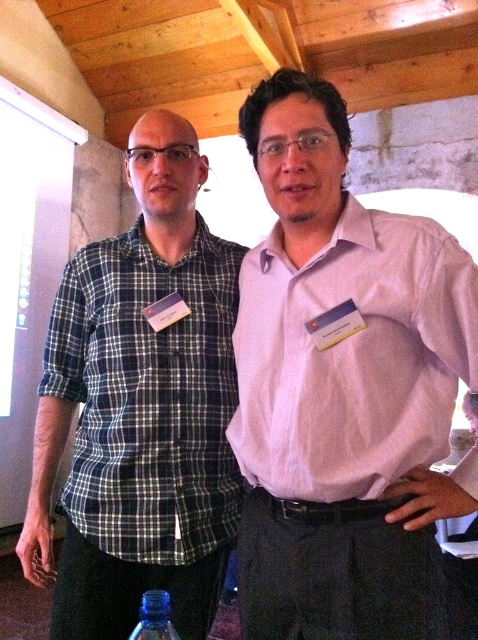
Question: Where is pink smooth shirt at center located in relation to transparent plastic bottle at lower center in the image?

Choices:
 (A) above
 (B) below

Answer: (A)

Question: Which point appears closest to the camera in this image?

Choices:
 (A) (141, 598)
 (B) (82, 321)

Answer: (A)

Question: Does pink smooth shirt at center have a lesser width compared to plaid cotton shirt at left?

Choices:
 (A) yes
 (B) no

Answer: (A)

Question: Which of the following is the farthest from the observer?

Choices:
 (A) (152, 602)
 (B) (99, 410)
 (C) (454, 304)

Answer: (B)

Question: Based on their relative distances, which object is farther from the plaid cotton shirt at left?

Choices:
 (A) transparent plastic bottle at lower center
 (B) pink smooth shirt at center

Answer: (A)

Question: Can you confirm if pink smooth shirt at center is positioned to the right of plaid cotton shirt at left?

Choices:
 (A) yes
 (B) no

Answer: (A)